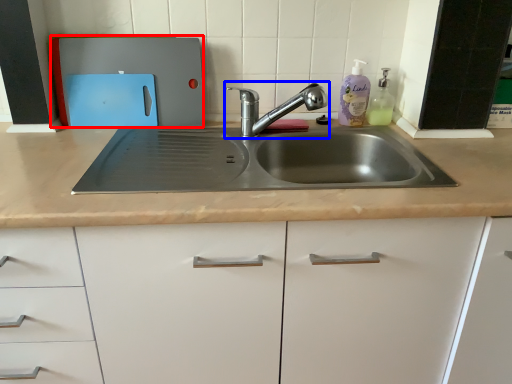
Question: Which object is further to the camera taking this photo, appliance (highlighted by a red box) or tap (highlighted by a blue box)?

Choices:
 (A) appliance
 (B) tap

Answer: (A)